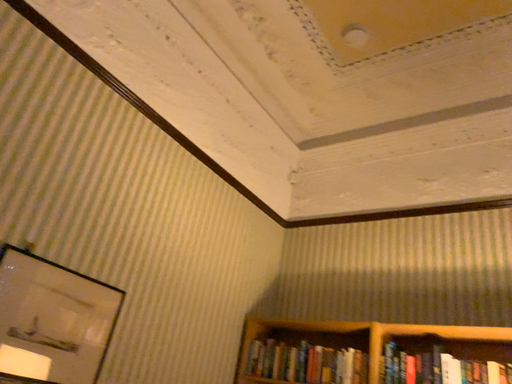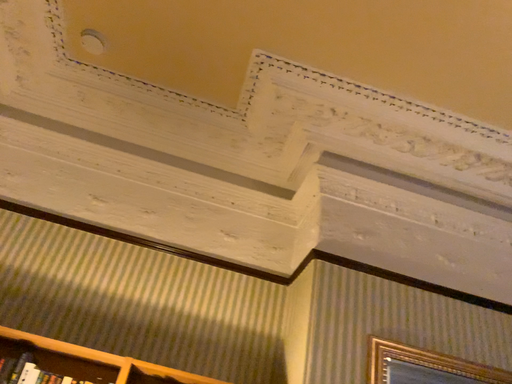
Question: How did the camera likely rotate when shooting the video?

Choices:
 (A) rotated right
 (B) rotated left

Answer: (A)